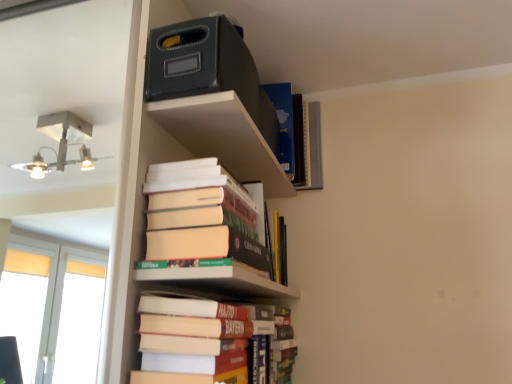
Measure the distance between point (x=238, y=328) and camera.

The depth of point (x=238, y=328) is 30.24 inches.

What is the approximate width of hardcover book at upper center, marked as the third book in a bottom-to-top arrangement?

It is 8.15 inches.

Locate an element on the screen. Image resolution: width=512 pixels, height=384 pixels. hardcover books at center, the 2th book positioned from the top is located at coordinates (203, 215).

Looking at this image, which is closer, (288, 86) or (217, 248)?

The point (217, 248) is closer.

Would you say hardcover book at upper center, the 1th book positioned from the top, is a long distance from hardcover books at center, which is counted as the 2th book, starting from the bottom?

hardcover book at upper center, the 1th book positioned from the top, is near hardcover books at center, which is counted as the 2th book, starting from the bottom, not far away.

Which object is further away from the camera, hardcover book at upper center, the 1th book positioned from the top, or hardcover books at center, the 2th book positioned from the top?

hardcover book at upper center, the 1th book positioned from the top, is further from the camera.

Can you confirm if hardcover book at upper center, marked as the third book in a bottom-to-top arrangement, is bigger than hardcover books at center, the 2th book positioned from the top?

No, hardcover book at upper center, marked as the third book in a bottom-to-top arrangement, is not bigger than hardcover books at center, the 2th book positioned from the top.

From the image's perspective, relative to hardcover book at upper center, the 1th book positioned from the top, is hardcover books at lower center, the 3th book positioned from the top, above or below?

hardcover books at lower center, the 3th book positioned from the top, is below hardcover book at upper center, the 1th book positioned from the top.

Does hardcover books at lower center, which is counted as the 1th book, starting from the bottom, have a lesser height compared to hardcover book at upper center, marked as the third book in a bottom-to-top arrangement?

Correct, hardcover books at lower center, which is counted as the 1th book, starting from the bottom, is not as tall as hardcover book at upper center, marked as the third book in a bottom-to-top arrangement.

Is hardcover book at upper center, marked as the third book in a bottom-to-top arrangement, a part of hardcover books at lower center, which is counted as the 1th book, starting from the bottom?

No, hardcover book at upper center, marked as the third book in a bottom-to-top arrangement, is not surrounded by hardcover books at lower center, which is counted as the 1th book, starting from the bottom.

From the picture: How different are the orientations of hardcover books at lower center, which is counted as the 1th book, starting from the bottom, and hardcover book at upper center, marked as the third book in a bottom-to-top arrangement, in degrees?

There is a 0.00037-degree angle between the facing directions of hardcover books at lower center, which is counted as the 1th book, starting from the bottom, and hardcover book at upper center, marked as the third book in a bottom-to-top arrangement.

Between point (188, 225) and point (283, 157), which one is positioned in front?

The point (188, 225) is closer to the camera.

Based on the photo, based on their sizes in the image, would you say hardcover books at center, the 2th book positioned from the top, is bigger or smaller than hardcover book at upper center, the 1th book positioned from the top?

Clearly, hardcover books at center, the 2th book positioned from the top, is larger in size than hardcover book at upper center, the 1th book positioned from the top.

Are hardcover books at center, the 2th book positioned from the top, and hardcover book at upper center, marked as the third book in a bottom-to-top arrangement, located far from each other?

Actually, hardcover books at center, the 2th book positioned from the top, and hardcover book at upper center, marked as the third book in a bottom-to-top arrangement, are a little close together.

Which object is thinner, hardcover books at center, the 2th book positioned from the top, or hardcover book at upper center, marked as the third book in a bottom-to-top arrangement?

hardcover books at center, the 2th book positioned from the top, is thinner.

Could you tell me if hardcover book at upper center, marked as the third book in a bottom-to-top arrangement, is facing hardcover books at lower center, the 3th book positioned from the top?

No, hardcover book at upper center, marked as the third book in a bottom-to-top arrangement, is not aimed at hardcover books at lower center, the 3th book positioned from the top.

From a real-world perspective, is hardcover book at upper center, marked as the third book in a bottom-to-top arrangement, physically above hardcover books at lower center, the 3th book positioned from the top?

Yes, from a real-world perspective, hardcover book at upper center, marked as the third book in a bottom-to-top arrangement, is above hardcover books at lower center, the 3th book positioned from the top.

In the scene shown: How different are the orientations of hardcover book at upper center, marked as the third book in a bottom-to-top arrangement, and hardcover books at lower center, the 3th book positioned from the top, in degrees?

They differ by 0.00037 degrees in their facing directions.

Who is shorter, hardcover book at upper center, marked as the third book in a bottom-to-top arrangement, or hardcover books at lower center, which is counted as the 1th book, starting from the bottom?

With less height is hardcover books at lower center, which is counted as the 1th book, starting from the bottom.

Based on the photo, visually, is hardcover book at center positioned to the left or to the right of hardcover books at center, the 2th book positioned from the top?

hardcover book at center is positioned on hardcover books at center, the 2th book positioned from the top,'s left side.

From the image's perspective, is hardcover book at center above or below hardcover books at center, the 2th book positioned from the top?

From the image's perspective, hardcover book at center appears below hardcover books at center, the 2th book positioned from the top.

From a real-world perspective, which object rests below the other?

hardcover book at center, from a real-world perspective.

Which of these two, hardcover book at center or hardcover books at center, the 2th book positioned from the top, is wider?

hardcover books at center, the 2th book positioned from the top, is wider.

Considering the sizes of objects hardcover books at center, which is counted as the 2th book, starting from the bottom, and hardcover books at lower center, the 3th book positioned from the top, in the image provided, who is smaller, hardcover books at center, which is counted as the 2th book, starting from the bottom, or hardcover books at lower center, the 3th book positioned from the top,?

hardcover books at lower center, the 3th book positioned from the top, is smaller.

Does hardcover books at center, the 2th book positioned from the top, have a lesser width compared to hardcover books at lower center, the 3th book positioned from the top?

No.

From their relative heights in the image, would you say hardcover books at center, the 2th book positioned from the top, is taller or shorter than hardcover books at lower center, the 3th book positioned from the top?

Considering their sizes, hardcover books at center, the 2th book positioned from the top, has more height than hardcover books at lower center, the 3th book positioned from the top.

In the image, is hardcover books at center, the 2th book positioned from the top, on the left side or the right side of hardcover books at lower center, the 3th book positioned from the top?

Clearly, hardcover books at center, the 2th book positioned from the top, is on the right of hardcover books at lower center, the 3th book positioned from the top, in the image.

Does hardcover books at lower center, which is counted as the 1th book, starting from the bottom, have a greater width compared to hardcover book at center?

Indeed, hardcover books at lower center, which is counted as the 1th book, starting from the bottom, has a greater width compared to hardcover book at center.

From a real-world perspective, who is located higher, hardcover books at lower center, which is counted as the 1th book, starting from the bottom, or hardcover book at center?

hardcover books at lower center, which is counted as the 1th book, starting from the bottom, from a real-world perspective.

Can you confirm if hardcover books at lower center, the 3th book positioned from the top, is bigger than hardcover book at center?

Yes.

The width and height of the screenshot is (512, 384). Find the location of `book on the right of hardcover books at center, which is counted as the 2th book, starting from the bottom`. book on the right of hardcover books at center, which is counted as the 2th book, starting from the bottom is located at coordinates (298, 136).

From a real-world perspective, starting from the hardcover books at lower center, which is counted as the 1th book, starting from the bottom, which book is the 2nd one vertically above it? Please provide its 2D coordinates.

[(298, 136)]

Based on their spatial positions, is hardcover books at center, which is counted as the 2th book, starting from the bottom, or hardcover book at upper center, marked as the third book in a bottom-to-top arrangement, further from hardcover books at lower center, the 3th book positioned from the top?

hardcover book at upper center, marked as the third book in a bottom-to-top arrangement, lies further to hardcover books at lower center, the 3th book positioned from the top, than the other object.

Which object lies further to the anchor point hardcover books at lower center, the 3th book positioned from the top, hardcover book at upper center, the 1th book positioned from the top, or hardcover book at center?

hardcover book at upper center, the 1th book positioned from the top, is further to hardcover books at lower center, the 3th book positioned from the top.

Considering their positions, is hardcover books at center, the 2th book positioned from the top, positioned closer to hardcover book at center than hardcover books at lower center, which is counted as the 1th book, starting from the bottom?

Based on the image, hardcover books at lower center, which is counted as the 1th book, starting from the bottom, appears to be nearer to hardcover book at center.

Estimate the real-world distances between objects in this image. Which object is further from hardcover books at lower center, the 3th book positioned from the top, hardcover book at center or hardcover book at upper center, marked as the third book in a bottom-to-top arrangement?

hardcover book at upper center, marked as the third book in a bottom-to-top arrangement.

Consider the image. From the image, which object appears to be nearer to hardcover books at lower center, the 3th book positioned from the top, hardcover books at center, which is counted as the 2th book, starting from the bottom, or hardcover book at center?

Based on the image, hardcover book at center appears to be nearer to hardcover books at lower center, the 3th book positioned from the top.

Looking at this image, based on their spatial positions, is hardcover books at lower center, the 3th book positioned from the top, or hardcover books at center, the 2th book positioned from the top, further from hardcover book at upper center, the 1th book positioned from the top?

hardcover books at lower center, the 3th book positioned from the top, is positioned further to the anchor hardcover book at upper center, the 1th book positioned from the top.

Which object lies further to the anchor point hardcover book at center, hardcover books at lower center, which is counted as the 1th book, starting from the bottom, or hardcover books at center, the 2th book positioned from the top?

hardcover books at center, the 2th book positioned from the top, is positioned further to the anchor hardcover book at center.

Looking at the image, which one is located further to hardcover books at center, which is counted as the 2th book, starting from the bottom, hardcover book at center or hardcover book at upper center, the 1th book positioned from the top?

hardcover book at upper center, the 1th book positioned from the top, is positioned further to the anchor hardcover books at center, which is counted as the 2th book, starting from the bottom.

Identify the location of book between hardcover books at lower center, which is counted as the 1th book, starting from the bottom, and hardcover book at upper center, marked as the third book in a bottom-to-top arrangement, in the front-back direction. The image size is (512, 384). (203, 215).

Image resolution: width=512 pixels, height=384 pixels. Find the location of `paperback book between hardcover books at center, the 2th book positioned from the top, and hardcover books at lower center, which is counted as the 1th book, starting from the bottom, vertically`. paperback book between hardcover books at center, the 2th book positioned from the top, and hardcover books at lower center, which is counted as the 1th book, starting from the bottom, vertically is located at coordinates (189, 377).